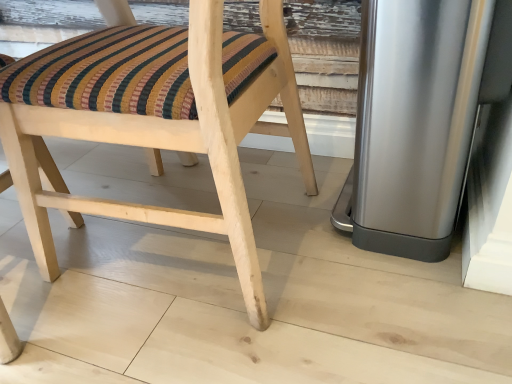
At what (x,y) coordinates should I click in order to perform the action: click on vacant area that is in front of polished stainless steel trash can at right. Please return your answer as a coordinate pair (x, y). Looking at the image, I should click on (397, 324).